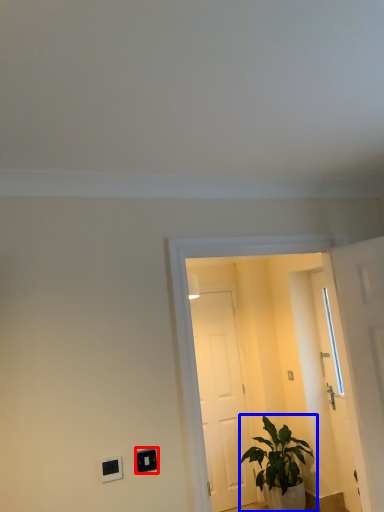
Question: Which object appears farthest to the camera in this image, light switch (highlighted by a red box) or houseplant (highlighted by a blue box)?

Choices:
 (A) light switch
 (B) houseplant

Answer: (B)